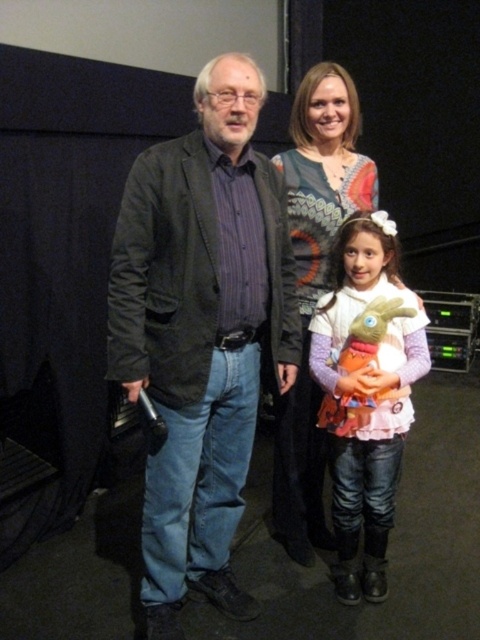
You are a photographer at the event and need to adjust the lighting to ensure both the dark gray textured blazer at center and the knitted sweater at center are well lit. Which clothing item should you focus on first if the blazer reflects more light than the sweater?

The dark gray textured blazer at center should be focused on first because it reflects more light than the knitted sweater at center, so it requires less intense lighting to achieve proper exposure.

You are standing at the point labeled point [238,198] and want to walk to the point labeled point [406,336]. Which direction should you face to walk straight towards your destination?

You should face downward because point [238,198] is in front of point [406,336].

Looking at this image, you are a photographer at the event and need to capture a photo that includes both the dark gray textured blazer at center and the pink fluffy dress at center. Which one should you position on the left side of the frame to ensure both are visible?

The dark gray textured blazer at center is already positioned on the left side of the pink fluffy dress at center, so you should keep it on the left side of the frame to ensure both are visible.